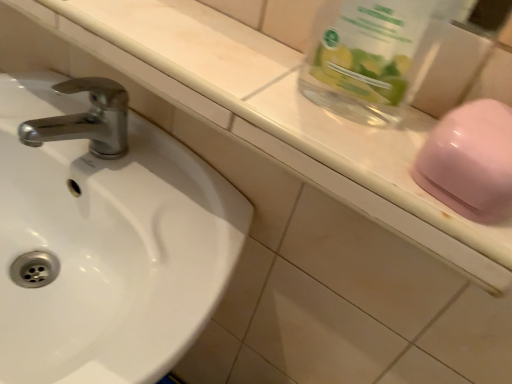
Question: Choose the correct answer: Is glossy plastic soap at right inside white glossy sink at left or outside it?

Choices:
 (A) outside
 (B) inside

Answer: (A)

Question: Is point (459, 114) positioned closer to the camera than point (103, 193)?

Choices:
 (A) farther
 (B) closer

Answer: (B)

Question: Considering the real-world distances, which object is closest to the white glossy sink at left?

Choices:
 (A) glossy plastic soap at right
 (B) transparent glass jar at upper right

Answer: (B)

Question: Based on their relative distances, which object is farther from the glossy plastic soap at right?

Choices:
 (A) white glossy sink at left
 (B) transparent glass jar at upper right

Answer: (A)